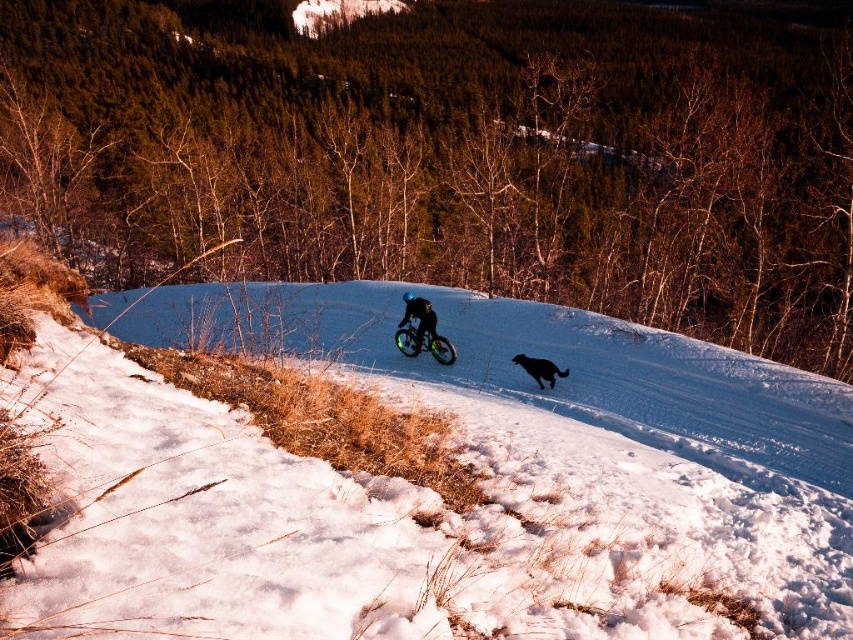
Who is positioned more to the left, green rubber mountain bike at center or black fur dog at center?

Positioned to the left is green rubber mountain bike at center.

Is green rubber mountain bike at center positioned at the back of black fur dog at center?

Yes, green rubber mountain bike at center is further from the viewer.

Is point (398, 349) closer to viewer compared to point (537, 378)?

No, (398, 349) is behind (537, 378).

The height and width of the screenshot is (640, 853). I want to click on green rubber mountain bike at center, so click(422, 342).

Is point (431, 332) behind point (566, 371)?

Yes, point (431, 332) is behind point (566, 371).

Which is above, shiny black jacket at center or black fur dog at center?

shiny black jacket at center is above.

Image resolution: width=853 pixels, height=640 pixels. Describe the element at coordinates (419, 317) in the screenshot. I see `shiny black jacket at center` at that location.

Where is `shiny black jacket at center`? The width and height of the screenshot is (853, 640). shiny black jacket at center is located at coordinates (419, 317).

Does point (410, 346) come behind point (409, 291)?

That is False.

This screenshot has height=640, width=853. What do you see at coordinates (422, 342) in the screenshot?
I see `green rubber mountain bike at center` at bounding box center [422, 342].

Where is `green rubber mountain bike at center`? green rubber mountain bike at center is located at coordinates (422, 342).